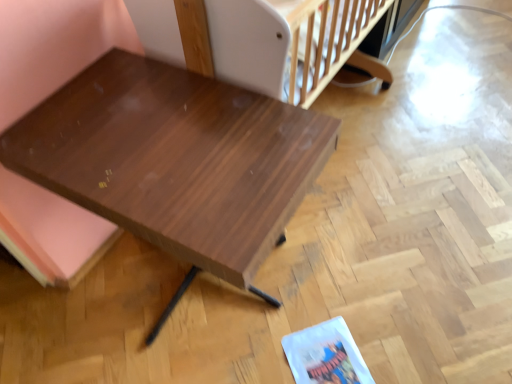
At what (x,y) coordinates should I click in order to perform the action: click on free point above shiny brown wood table at center (from a real-world perspective). Please return your answer as a coordinate pair (x, y). Looking at the image, I should click on (157, 142).